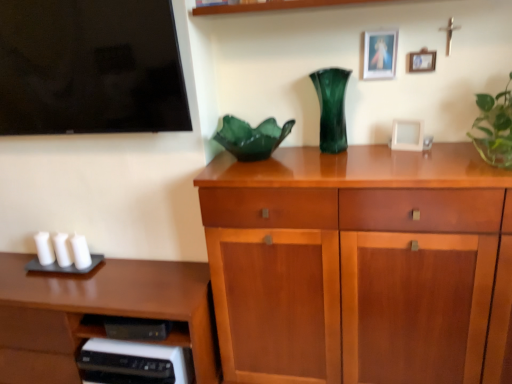
At what (x,y) coordinates should I click in order to perform the action: click on vacant space underneath green glass bowl at center, arranged as the 2th houseplant when viewed from the right (from a real-world perspective). Please return your answer as a coordinate pair (x, y). This screenshot has height=384, width=512. Looking at the image, I should click on (259, 154).